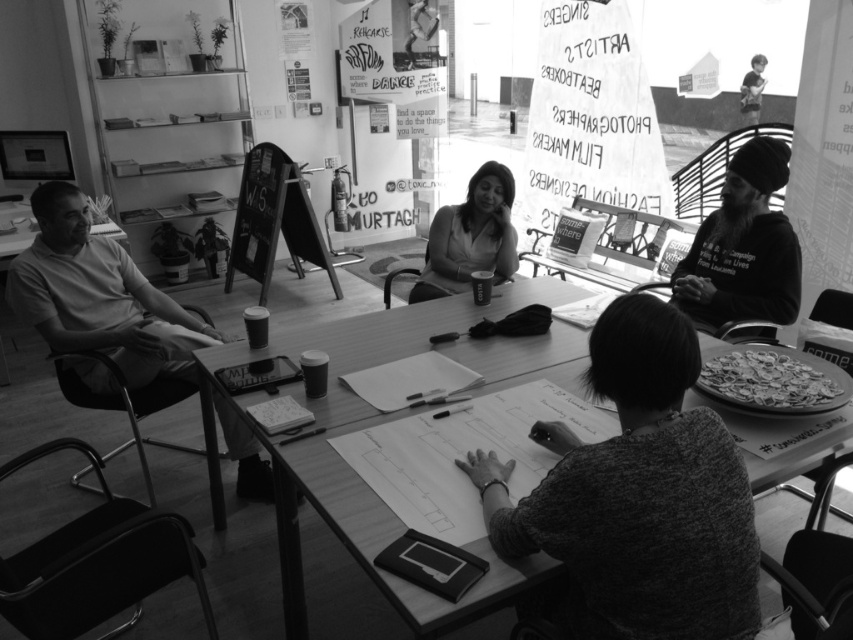
You are standing at the center of the room and see the point at coordinates point (99,294). What object is located at that point?

The point (99,294) corresponds to the smooth white shirt at left.